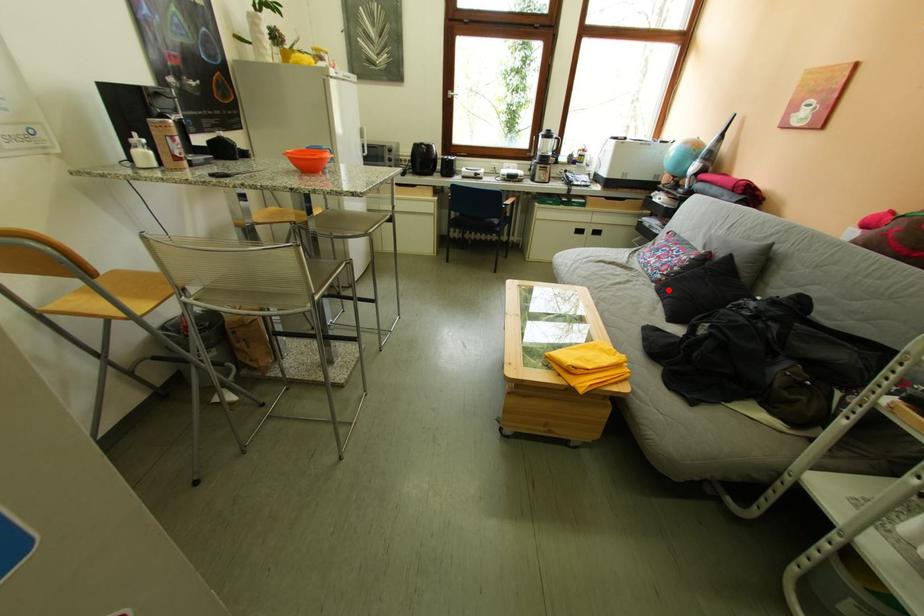
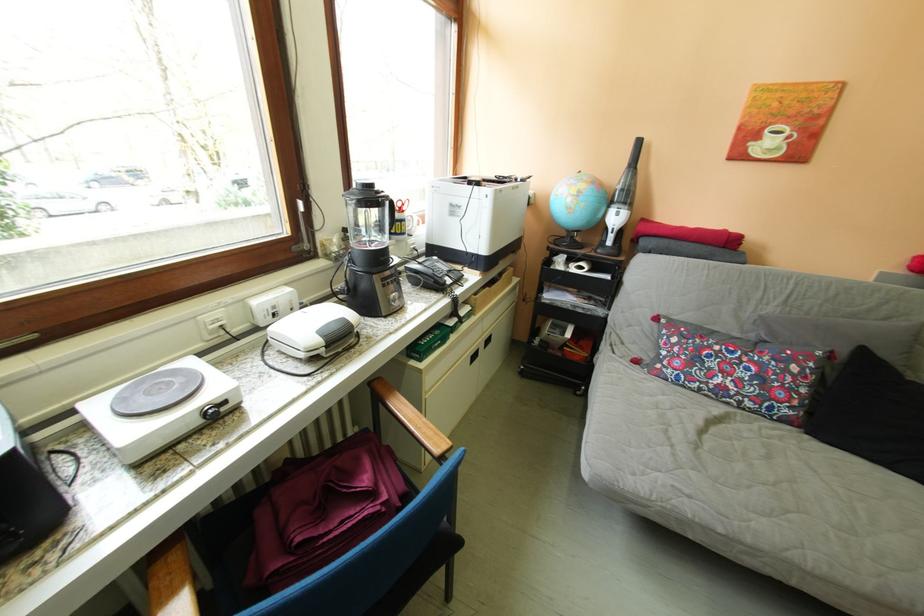
Find the pixel in the second image that matches the highlighted location in the first image.

(821, 437)